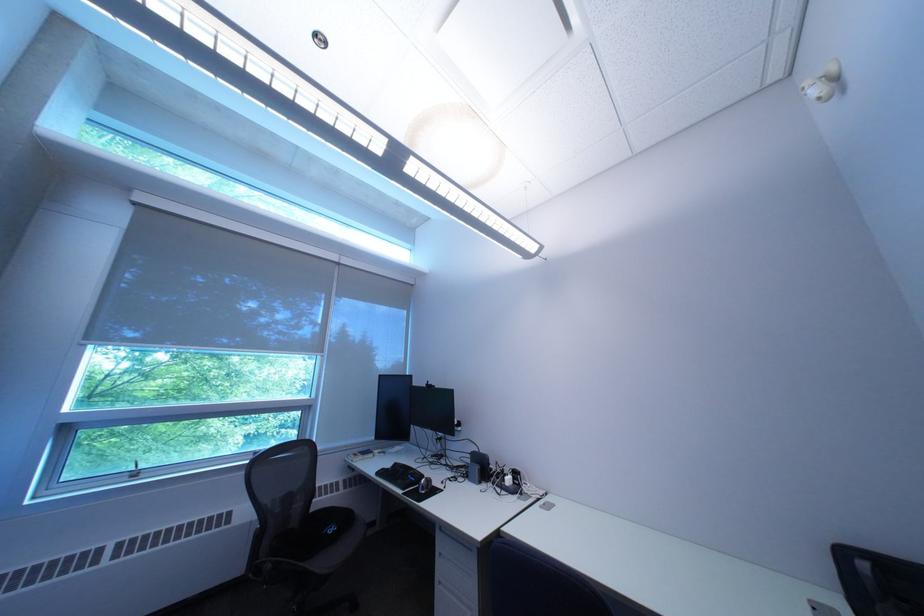
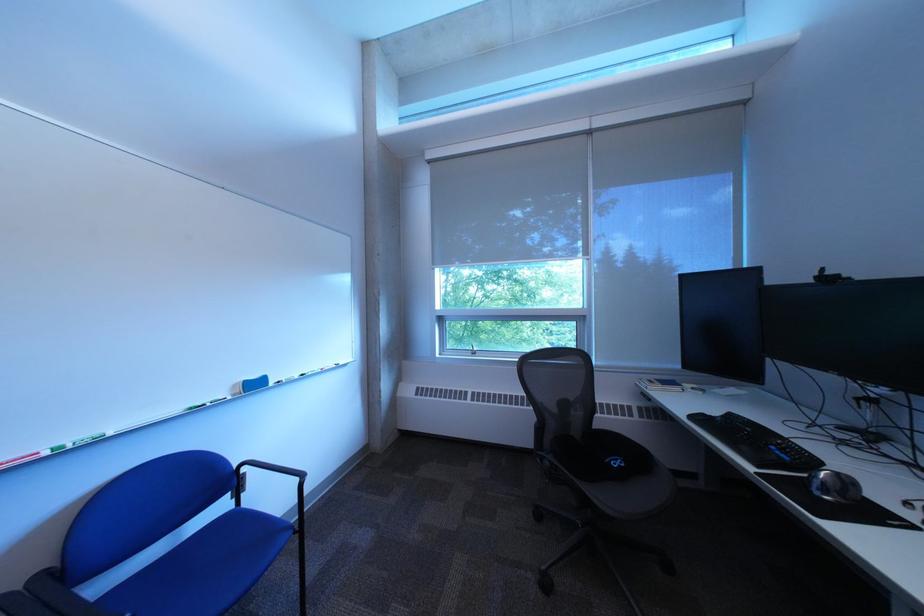
Locate, in the second image, the point that corresponds to [360,462] in the first image.

(651, 386)